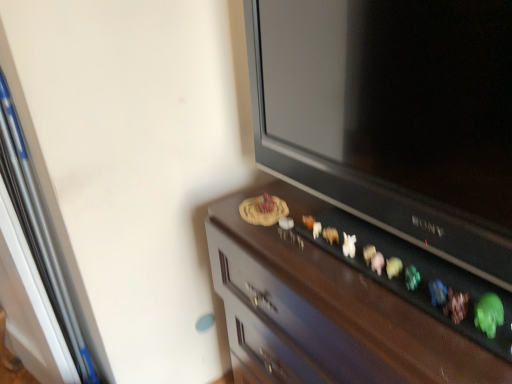
Image resolution: width=512 pixels, height=384 pixels. In order to click on free space underneath matte black television at upper right (from a real-world perspective) in this screenshot , I will do `click(325, 219)`.